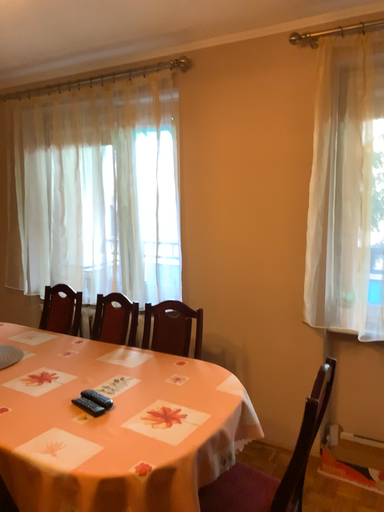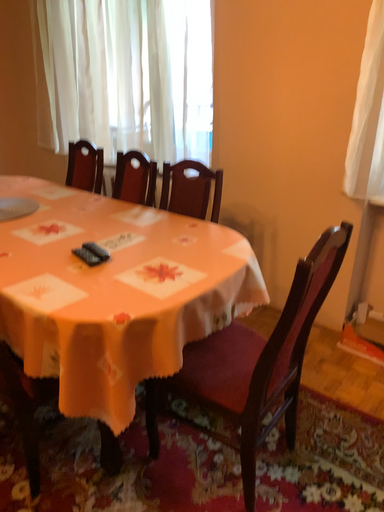
Question: Which way did the camera rotate in the video?

Choices:
 (A) rotated downward
 (B) rotated upward

Answer: (A)